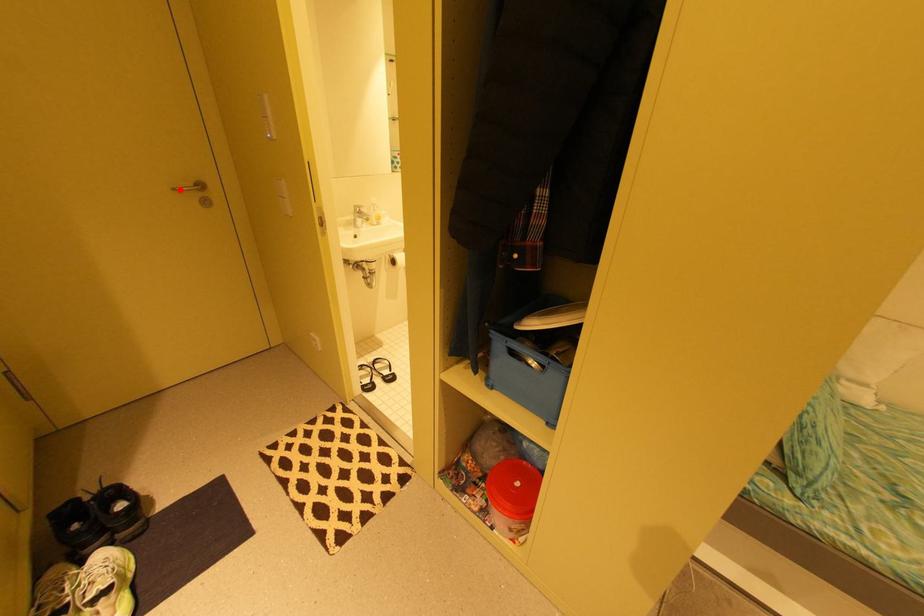
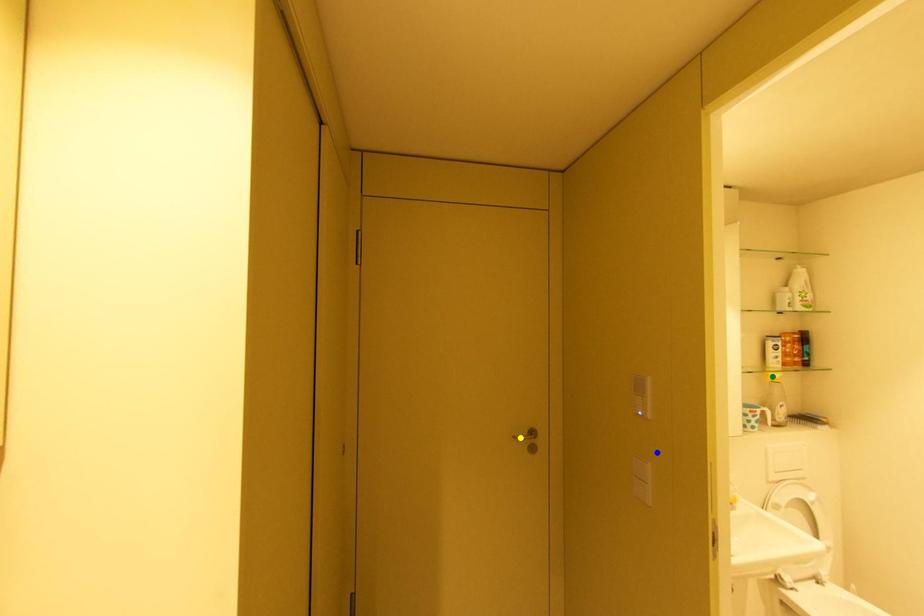
Question: I am providing you with two images of the same scene from different viewpoints. A red point is marked on the first image. You are given multiple points on the second image. Can you choose the point in image 2 that corresponds to the point in image 1?

Choices:
 (A) yellow point
 (B) green point
 (C) blue point

Answer: (A)